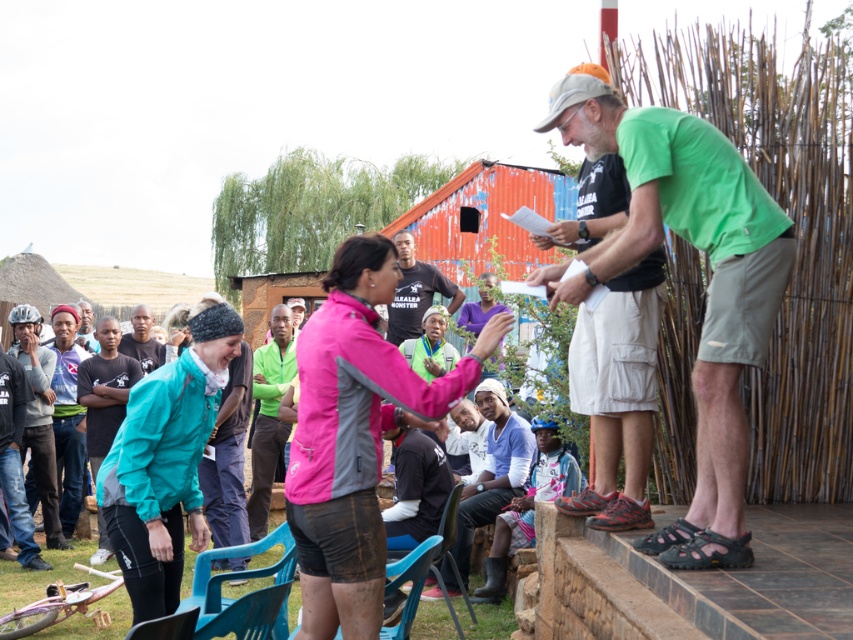
Between green fabric shirt at center and blue plastic chair at lower left, which one has more height?

green fabric shirt at center is taller.

Which is behind, point (265, 468) or point (199, 624)?

Point (265, 468)

Locate an element on the screen. The width and height of the screenshot is (853, 640). green fabric shirt at center is located at coordinates (270, 413).

Which is in front, point (270, 433) or point (120, 346)?

Positioned in front is point (270, 433).

The image size is (853, 640). I want to click on green fabric shirt at center, so click(270, 413).

Find the location of a particular element. The height and width of the screenshot is (640, 853). green fabric shirt at center is located at coordinates (270, 413).

Does green fabric shirt at center appear under black matte t-shirt at center?

Yes, green fabric shirt at center is below black matte t-shirt at center.

Is green fabric shirt at center further to the viewer compared to black matte t-shirt at center?

No.

Does point (257, 413) come farther from viewer compared to point (421, 292)?

No.

Where is `green fabric shirt at center`? green fabric shirt at center is located at coordinates (270, 413).